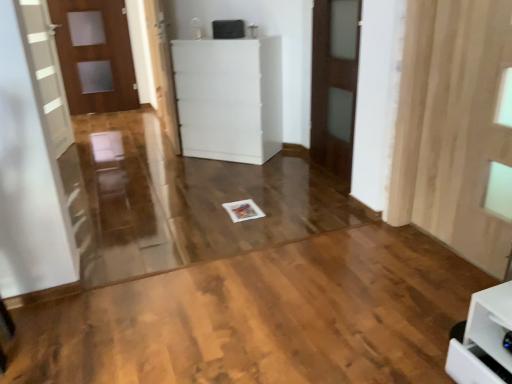
At what (x,y) coordinates should I click in order to perform the action: click on free space in front of white glossy door at center, acting as the second door starting from the back. Please return your answer as a coordinate pair (x, y). The image size is (512, 384). Looking at the image, I should click on (158, 162).